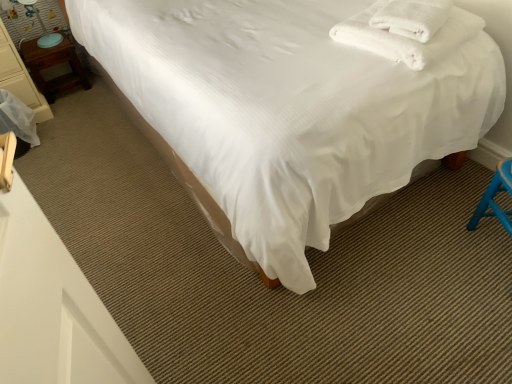
Question: Considering the relative sizes of wooden nightstand at left and white soft towel at upper right in the image provided, is wooden nightstand at left shorter than white soft towel at upper right?

Choices:
 (A) no
 (B) yes

Answer: (A)

Question: Is white soft towel at upper right a part of wooden nightstand at left?

Choices:
 (A) yes
 (B) no

Answer: (B)

Question: From a real-world perspective, is wooden nightstand at left over white soft towel at upper right?

Choices:
 (A) yes
 (B) no

Answer: (B)

Question: Is wooden nightstand at left facing away from white soft towel at upper right?

Choices:
 (A) no
 (B) yes

Answer: (A)

Question: Is wooden nightstand at left not inside white soft towel at upper right?

Choices:
 (A) no
 (B) yes

Answer: (B)

Question: Is wooden nightstand at left situated inside white soft towel at upper right or outside?

Choices:
 (A) outside
 (B) inside

Answer: (A)

Question: In terms of size, does wooden nightstand at left appear bigger or smaller than white soft towel at upper right?

Choices:
 (A) big
 (B) small

Answer: (A)

Question: Relative to white soft towel at upper right, is wooden nightstand at left in front or behind?

Choices:
 (A) front
 (B) behind

Answer: (B)

Question: Considering the positions of wooden nightstand at left and white soft towel at upper right in the image, is wooden nightstand at left taller or shorter than white soft towel at upper right?

Choices:
 (A) tall
 (B) short

Answer: (A)

Question: From the image's perspective, is matte blue table lamp at left positioned above or below wooden nightstand at left?

Choices:
 (A) below
 (B) above

Answer: (B)

Question: Is matte blue table lamp at left situated inside wooden nightstand at left or outside?

Choices:
 (A) outside
 (B) inside

Answer: (A)

Question: From a real-world perspective, is matte blue table lamp at left above or below wooden nightstand at left?

Choices:
 (A) below
 (B) above

Answer: (B)

Question: In terms of height, does matte blue table lamp at left look taller or shorter compared to wooden nightstand at left?

Choices:
 (A) short
 (B) tall

Answer: (B)

Question: In terms of height, does matte blue table lamp at left look taller or shorter compared to white smooth bed at center?

Choices:
 (A) tall
 (B) short

Answer: (B)

Question: Based on their positions, is matte blue table lamp at left located to the left or right of white smooth bed at center?

Choices:
 (A) left
 (B) right

Answer: (A)